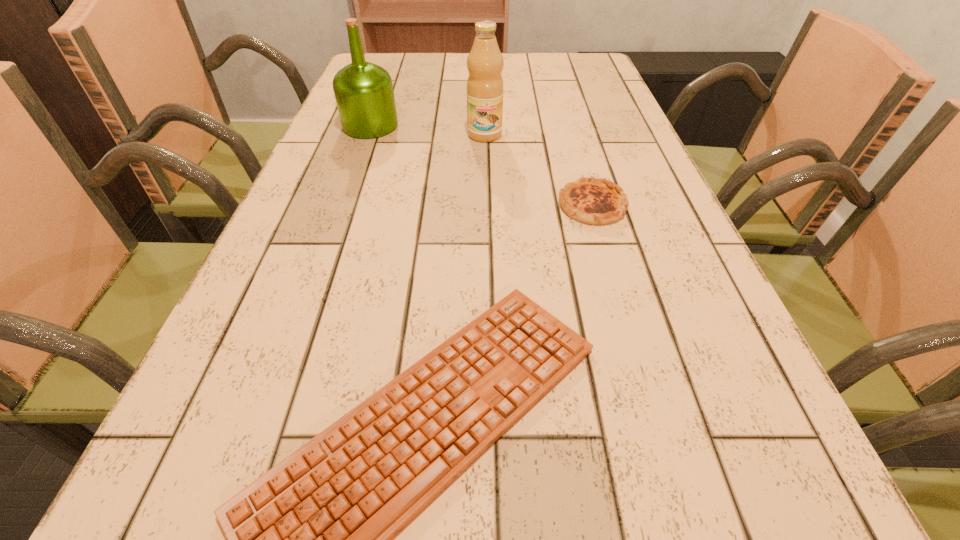
The height and width of the screenshot is (540, 960). Find the location of `free space at the left edge`. free space at the left edge is located at coordinates (281, 226).

Identify the location of free space at the right edge. The width and height of the screenshot is (960, 540). pos(630,306).

Where is `free location at the far left corner`? This screenshot has width=960, height=540. free location at the far left corner is located at coordinates (395, 57).

Locate an element on the screen. vacant space at the far right corner is located at coordinates (568, 53).

Where is `vacant area between the right olive oil and the third farthest object`? The height and width of the screenshot is (540, 960). vacant area between the right olive oil and the third farthest object is located at coordinates (539, 170).

At what (x,y) coordinates should I click in order to perform the action: click on free spot between the right olive oil and the left olive oil. Please return your answer as a coordinate pair (x, y). The image size is (960, 540). Looking at the image, I should click on (427, 130).

Find the location of a particular element. This screenshot has height=540, width=960. free spot between the third tallest object and the right olive oil is located at coordinates (539, 170).

Where is `free space between the left olive oil and the third tallest object`? Image resolution: width=960 pixels, height=540 pixels. free space between the left olive oil and the third tallest object is located at coordinates (481, 166).

This screenshot has height=540, width=960. I want to click on free space between the right olive oil and the third tallest object, so click(539, 170).

Image resolution: width=960 pixels, height=540 pixels. I want to click on unoccupied position between the second nearest object and the left olive oil, so click(481, 166).